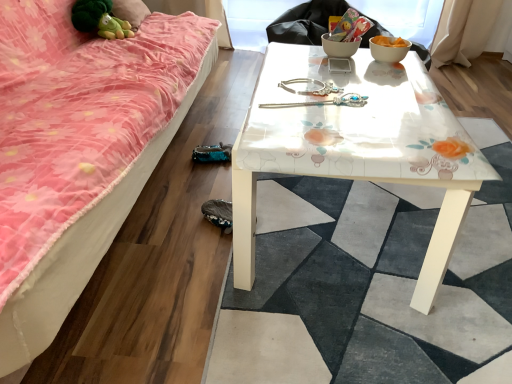
Where is `vacant space that is to the left of silver metallic hairpin at center`? This screenshot has height=384, width=512. vacant space that is to the left of silver metallic hairpin at center is located at coordinates (269, 101).